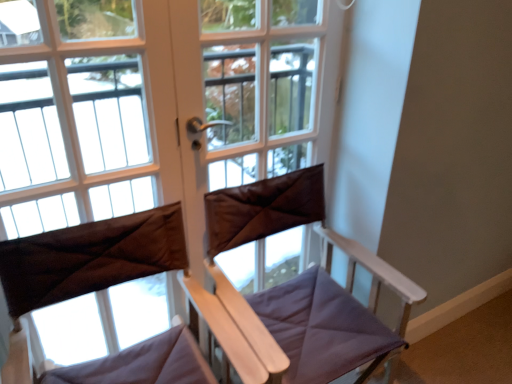
Question: Is brown fabric at center positioned before brown fabric curtain at center?

Choices:
 (A) yes
 (B) no

Answer: (B)

Question: Is brown fabric at center bigger than brown fabric curtain at center?

Choices:
 (A) no
 (B) yes

Answer: (A)

Question: Is the position of brown fabric at center more distant than that of brown fabric curtain at center?

Choices:
 (A) no
 (B) yes

Answer: (B)

Question: Are brown fabric at center and brown fabric curtain at center located far from each other?

Choices:
 (A) no
 (B) yes

Answer: (A)

Question: Can you confirm if brown fabric at center is positioned to the left of brown fabric curtain at center?

Choices:
 (A) yes
 (B) no

Answer: (B)

Question: From a real-world perspective, is brown fabric curtain at center positioned above or below brown leather screen door at center?

Choices:
 (A) above
 (B) below

Answer: (B)

Question: Visually, is brown fabric curtain at center positioned to the left or to the right of brown leather screen door at center?

Choices:
 (A) left
 (B) right

Answer: (A)

Question: From the image's perspective, is brown fabric curtain at center located above or below brown leather screen door at center?

Choices:
 (A) above
 (B) below

Answer: (B)

Question: Is brown fabric curtain at center spatially inside brown leather screen door at center, or outside of it?

Choices:
 (A) outside
 (B) inside

Answer: (A)

Question: Is point (265, 327) positioned closer to the camera than point (157, 208)?

Choices:
 (A) farther
 (B) closer

Answer: (A)

Question: From a real-world perspective, relative to brown fabric curtain at center, is purple fabric chair at center vertically above or below?

Choices:
 (A) above
 (B) below

Answer: (B)

Question: Relative to brown fabric curtain at center, is purple fabric chair at center in front or behind?

Choices:
 (A) front
 (B) behind

Answer: (B)

Question: Considering the positions of purple fabric chair at center and brown fabric curtain at center in the image, is purple fabric chair at center bigger or smaller than brown fabric curtain at center?

Choices:
 (A) big
 (B) small

Answer: (A)

Question: Considering the positions of brown fabric curtain at center and brown fabric at center in the image, is brown fabric curtain at center bigger or smaller than brown fabric at center?

Choices:
 (A) big
 (B) small

Answer: (A)

Question: Considering the positions of brown fabric curtain at center and brown fabric at center in the image, is brown fabric curtain at center taller or shorter than brown fabric at center?

Choices:
 (A) short
 (B) tall

Answer: (A)